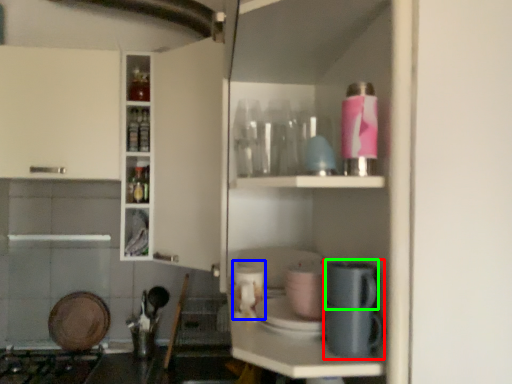
Question: Estimate the real-world distances between objects in this image. Which object is farther from coffee machine (highlighted by a red box), appliance (highlighted by a blue box) or appliance (highlighted by a green box)?

Choices:
 (A) appliance
 (B) appliance

Answer: (A)